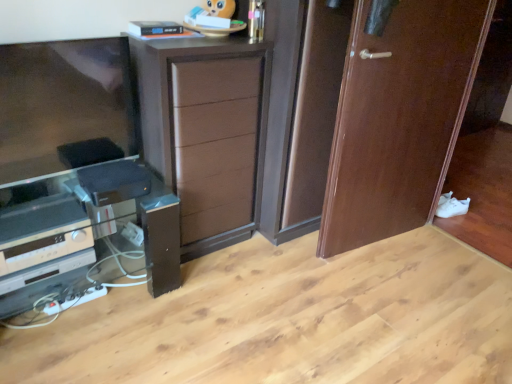
Locate an element on the screen. Image resolution: width=512 pixels, height=384 pixels. free location to the right of white matte shoe at lower right is located at coordinates (481, 216).